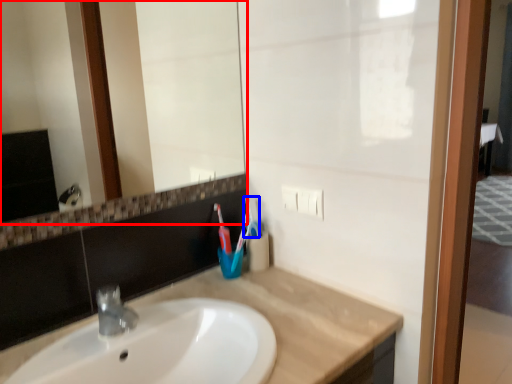
Question: Which point is closer to the camera, mirror (highlighted by a red box) or toothbrush (highlighted by a blue box)?

Choices:
 (A) mirror
 (B) toothbrush

Answer: (A)